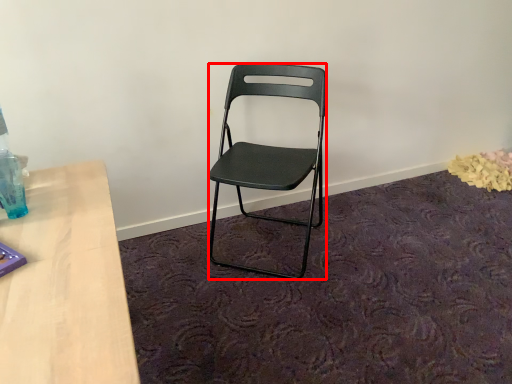
Question: In this image, where is chair (annotated by the red box) located relative to bottle?

Choices:
 (A) right
 (B) left

Answer: (A)